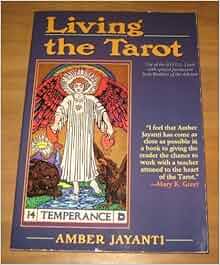
Where is `table`? This screenshot has height=265, width=220. table is located at coordinates [19, 38].